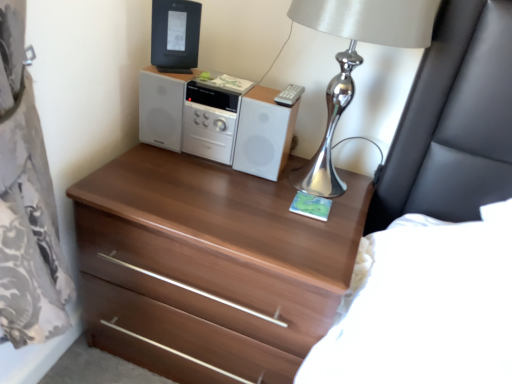
At what (x,y) coordinates should I click in order to perform the action: click on empty space that is ontop of white glossy stereo at center. Please return your answer as a coordinate pair (x, y). Looking at the image, I should click on [229, 89].